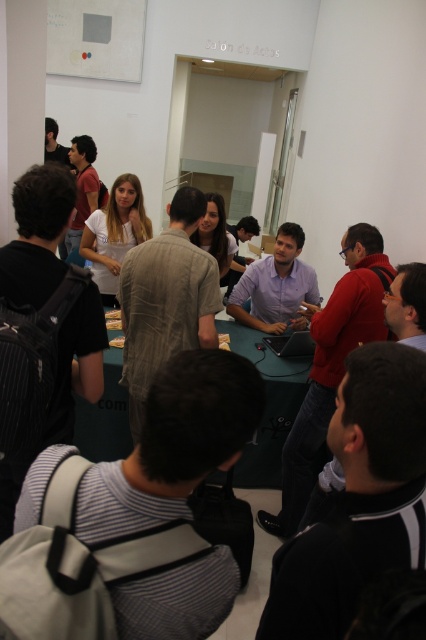
You are attending a meeting in the Sal??n de Actos and need to place a small note on the table. Where should you place it to ensure it is visible to both the person with light brown hair at center and the smooth wooden board at center?

Place the note between the light brown hair at center and the smooth wooden board at center since the light brown hair is above the smooth wooden board, so positioning it in between would make it visible to both.